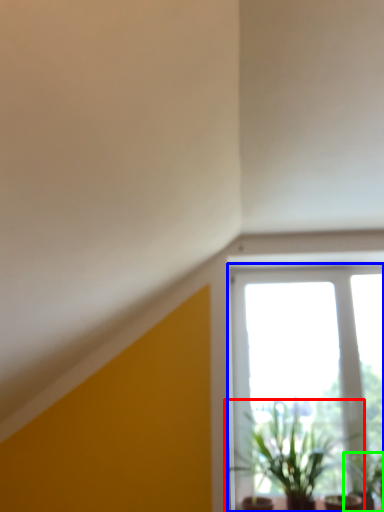
Question: Which object is positioned closest to houseplant (highlighted by a red box)? Select from window (highlighted by a blue box) and houseplant (highlighted by a green box).

Choices:
 (A) window
 (B) houseplant

Answer: (A)